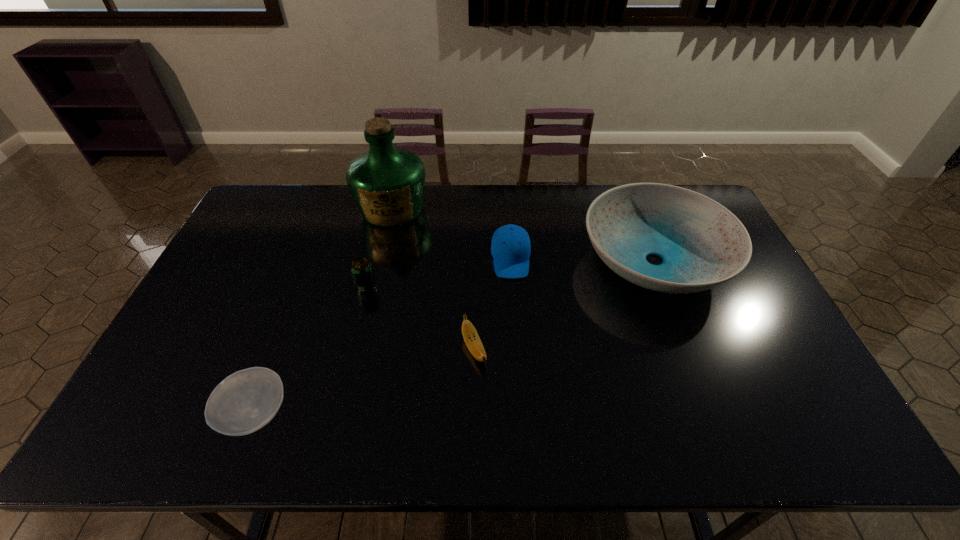
Where is `the tallest object`? This screenshot has height=540, width=960. the tallest object is located at coordinates (387, 183).

What are the coordinates of `the fifth shortest object` in the screenshot? It's located at (702, 244).

This screenshot has height=540, width=960. Identify the location of the rightmost object. (702, 244).

Find the location of a particular element. beer can is located at coordinates (361, 268).

Image resolution: width=960 pixels, height=540 pixels. I want to click on cap, so click(x=510, y=247).

The width and height of the screenshot is (960, 540). Identify the location of the third object from right to left. (x=470, y=335).

In order to click on the fifth farthest object in this screenshot , I will do `click(470, 335)`.

Locate an element on the screen. The width and height of the screenshot is (960, 540). bowl is located at coordinates (245, 401).

This screenshot has height=540, width=960. Identify the location of vacant space located 0.180m on the label side of the liquor. [x=378, y=270].

Locate an element on the screen. free space located 0.400m on the left of the dish is located at coordinates (455, 261).